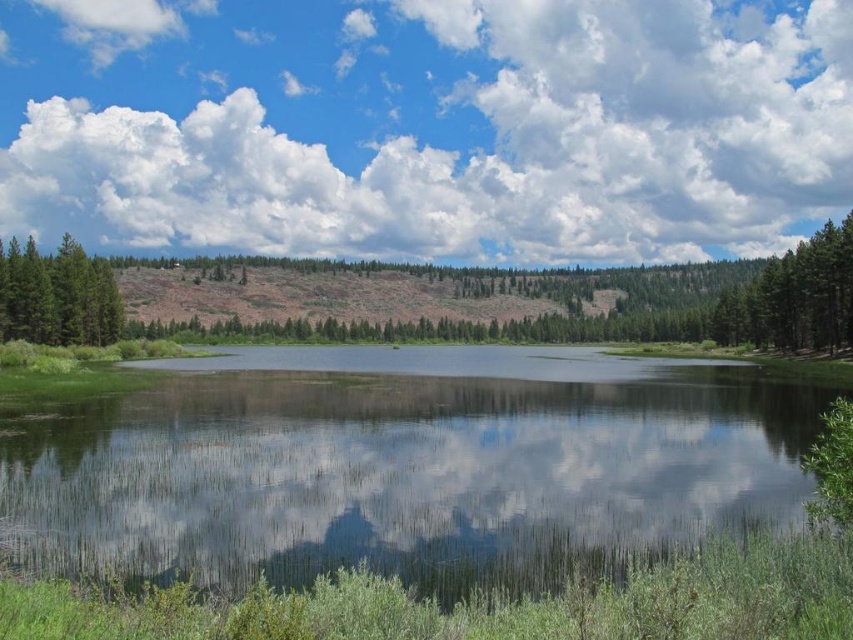
You are standing at the center of the image and want to walk towards the green grassy lake at center. According to the coordinates provided, in which direction should you move?

The green grassy lake at center is located at coordinates point (404, 465). Since you are at the center, which is typically at point (426, 320), you should move towards the right and slightly upward to reach it.